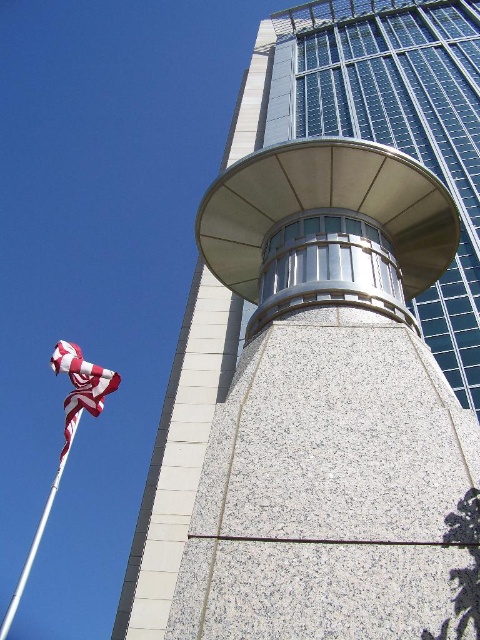
You are standing in front of the building and want to determine the relative heights of the striped fabric flag at left and the white glossy flag pole at lower left. Based on the scene, which one is taller?

The striped fabric flag at left is shorter than the white glossy flag pole at lower left, so the white glossy flag pole at lower left is taller.

You are standing in front of the modern architectural structure described. You notice the striped fabric flag at left and the white glossy flag pole at lower left. Which object has a smaller width?

The striped fabric flag at left has a lesser width compared to the white glossy flag pole at lower left.

You are standing at the base of the tower and want to take a photo of the point at coordinate point (78, 404). The camera you are using has a maximum focus range of 25 meters. Will the camera be able to focus on the point?

The distance of point (78, 404) from the camera is 24.48 meters, which is within the camera maximum focus range of 25 meters. Therefore, the camera can focus on the point.